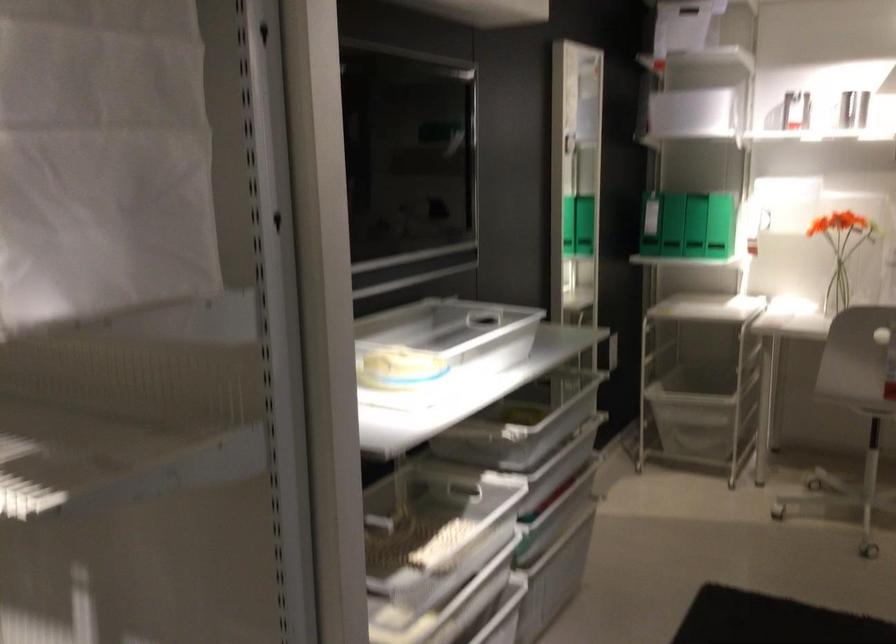
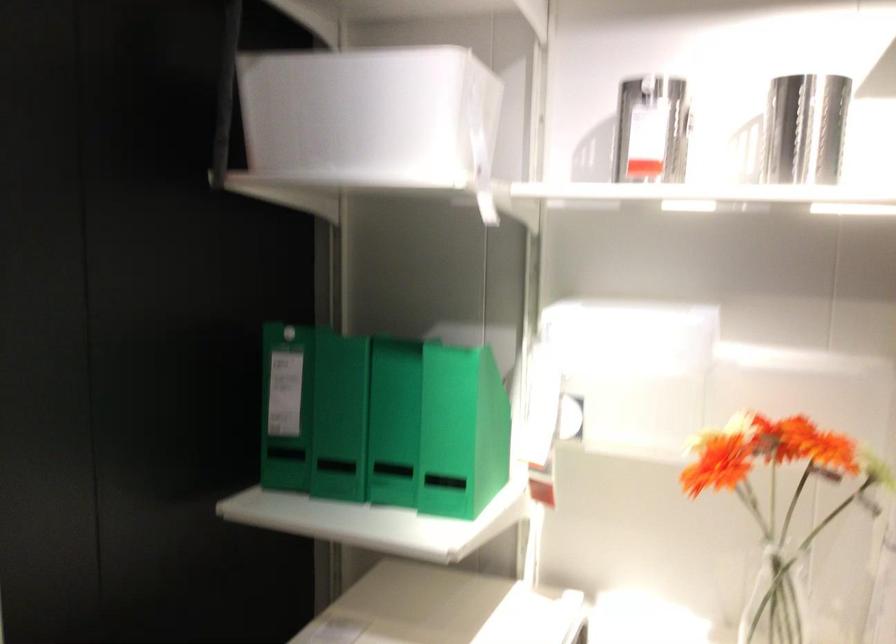
Where in the second image is the point corresponding to the point at 719,89 from the first image?

(373, 118)